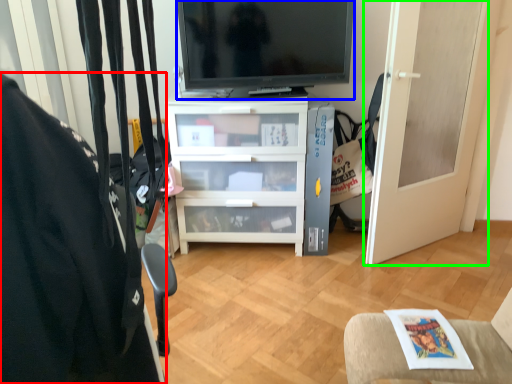
Question: Considering the real-world distances, which object is farthest from furniture (highlighted by a red box)? television (highlighted by a blue box) or door (highlighted by a green box)?

Choices:
 (A) television
 (B) door

Answer: (B)